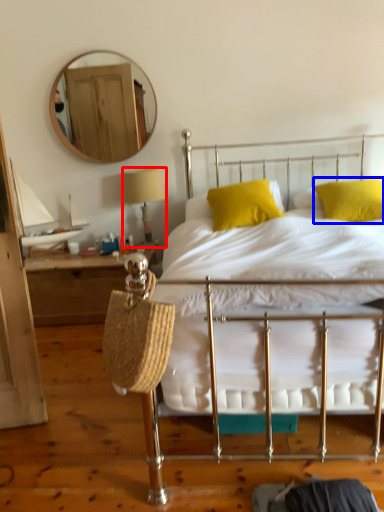
Question: Among these objects, which one is nearest to the camera, table lamp (highlighted by a red box) or pillow (highlighted by a blue box)?

Choices:
 (A) table lamp
 (B) pillow

Answer: (B)